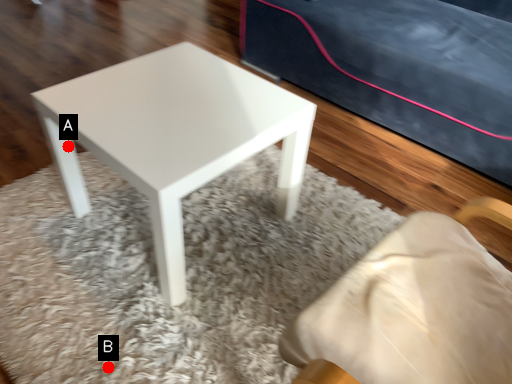
Question: Two points are circled on the image, labeled by A and B beside each circle. Which point is closer to the camera taking this photo?

Choices:
 (A) A is closer
 (B) B is closer

Answer: (B)